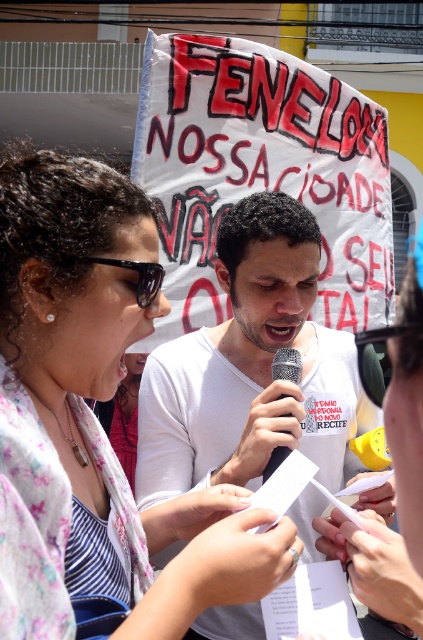
Between point (264, 380) and point (268, 461), which one is positioned behind?

Positioned behind is point (264, 380).

Where is `white matte shirt at center`? white matte shirt at center is located at coordinates 252,368.

Does matte white scarf at upper left appear on the left side of metallic silver microphone at center?

Yes, matte white scarf at upper left is to the left of metallic silver microphone at center.

Does matte white scarf at upper left appear on the right side of metallic silver microphone at center?

No, matte white scarf at upper left is not to the right of metallic silver microphone at center.

Locate an element on the screen. This screenshot has width=423, height=640. matte white scarf at upper left is located at coordinates (96, 422).

Find the location of a particular element. matte white scarf at upper left is located at coordinates (96, 422).

Is matte white scarf at upper left to the left of white matte shirt at center from the viewer's perspective?

Indeed, matte white scarf at upper left is positioned on the left side of white matte shirt at center.

From the picture: Can you confirm if matte white scarf at upper left is positioned below white matte shirt at center?

Indeed, matte white scarf at upper left is positioned under white matte shirt at center.

Who is more distant from viewer, (5, 522) or (280, 406)?

Point (280, 406)

Identify the location of matte white scarf at upper left. Image resolution: width=423 pixels, height=640 pixels. (96, 422).